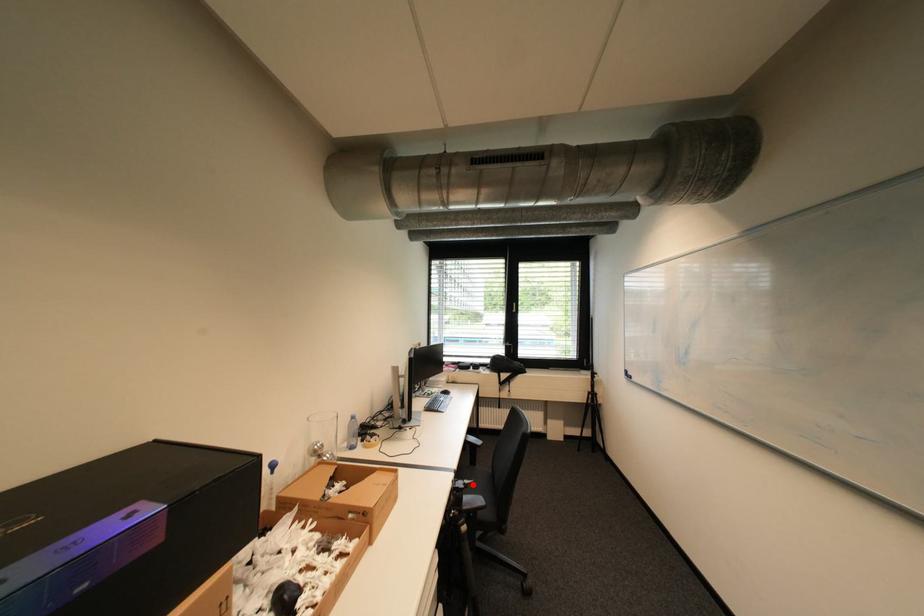
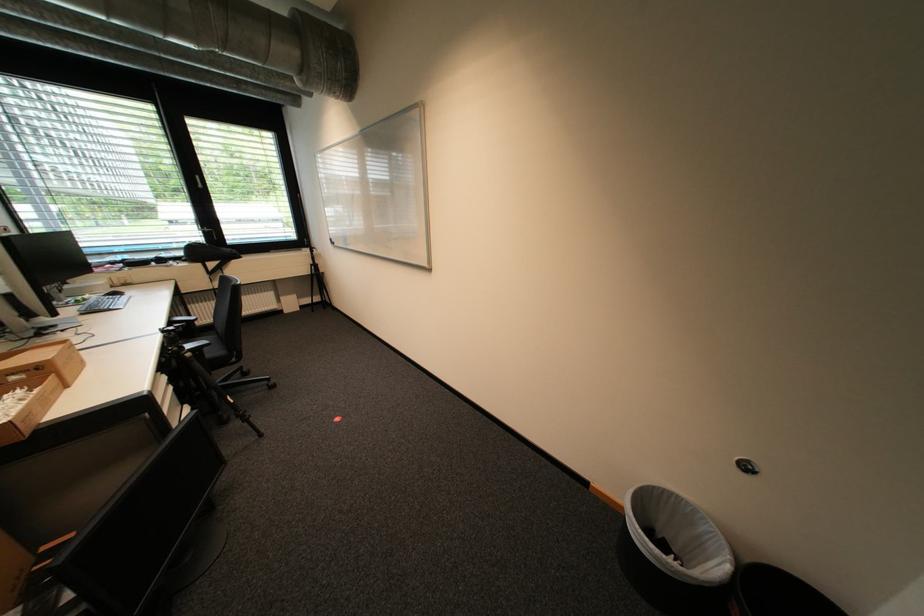
Question: I am providing you with two images of the same scene from different viewpoints. In image1, a red point is highlighted. Considering the same 3D point in image2, which of the following is correct?

Choices:
 (A) It is closer
 (B) It is farther

Answer: (A)